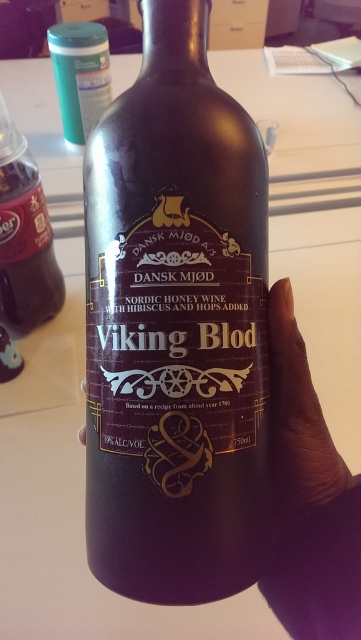
You are organizing a medieval feast and have both the purple matte bottle at center and the matte green plastic container at upper left on a shelf. Which item is positioned to the right side of the shelf?

The purple matte bottle at center is positioned to the right of the matte green plastic container at upper left, so the purple matte bottle at center is on the right side of the shelf.

You are a delivery person who needs to place the purple matte bottle at center into a storage box that is 24 inches deep. Can you fit it without tilting the bottle?

The purple matte bottle at center is 24.10 inches from viewer, which is slightly longer than the box depth of 24 inches. Therefore, it cannot be placed upright in the box without tilting.